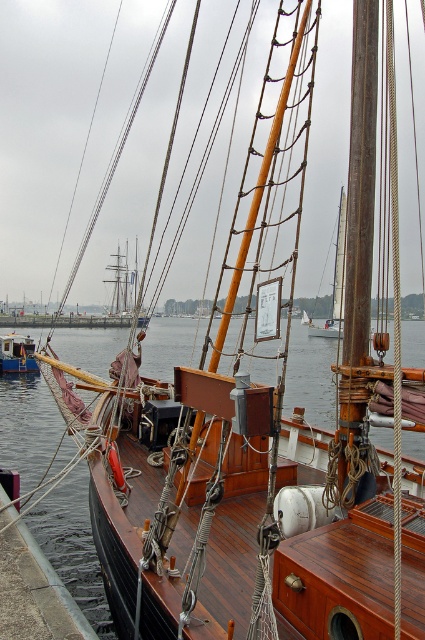
Question: Which of the following is the closest to the observer?

Choices:
 (A) wooden boat at lower left
 (B) wooden mast at center
 (C) brown wood deck at lower left

Answer: (C)

Question: Can you confirm if brown wood deck at lower left is smaller than wooden mast at center?

Choices:
 (A) yes
 (B) no

Answer: (A)

Question: In this image, where is wooden mast at center located relative to wooden boat at lower left?

Choices:
 (A) above
 (B) below

Answer: (A)

Question: Does brown wood deck at lower left have a lesser width compared to wooden mast at center?

Choices:
 (A) yes
 (B) no

Answer: (A)

Question: Which of these objects is positioned farthest from the transparent water at center?

Choices:
 (A) wooden boat at lower left
 (B) brown wood deck at lower left

Answer: (A)

Question: Which object is closer to the camera taking this photo?

Choices:
 (A) wooden mast at center
 (B) wooden boat at lower left
 (C) brown wood deck at lower left

Answer: (C)